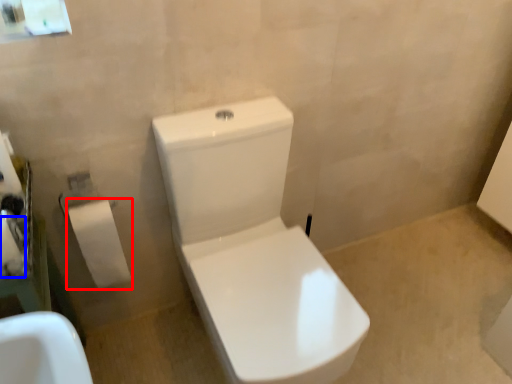
Question: Among these objects, which one is farthest to the camera, toiletry (highlighted by a red box) or toilet paper (highlighted by a blue box)?

Choices:
 (A) toiletry
 (B) toilet paper

Answer: (A)